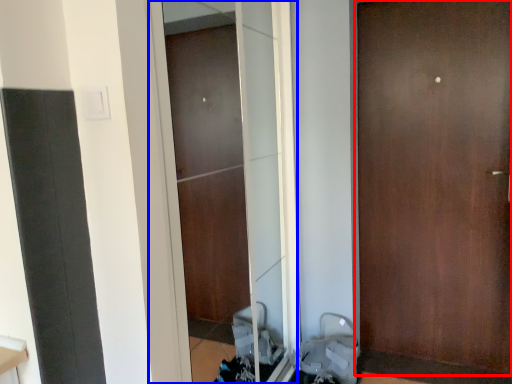
Question: Which object is closer to the camera taking this photo, door (highlighted by a red box) or screen door (highlighted by a blue box)?

Choices:
 (A) door
 (B) screen door

Answer: (B)